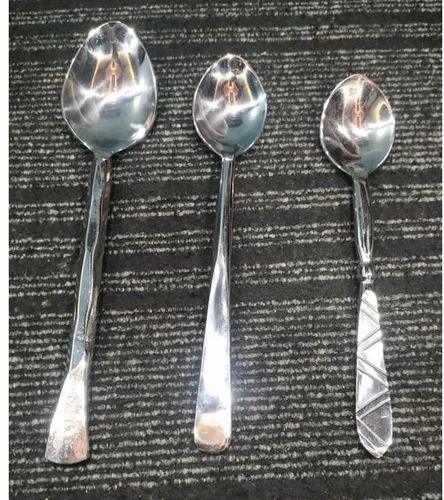
The height and width of the screenshot is (500, 444). I want to click on surface, so click(x=323, y=436).